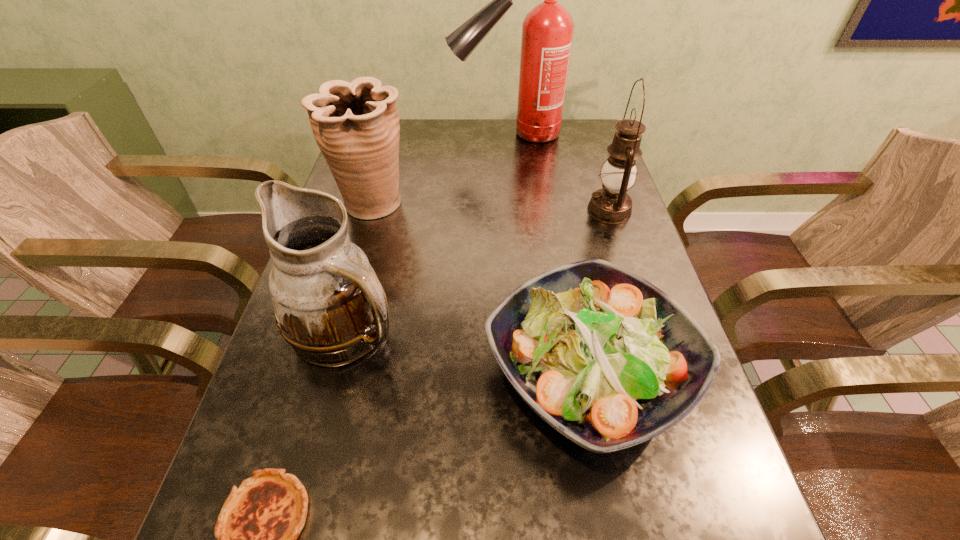
The height and width of the screenshot is (540, 960). What are the coordinates of `free region at the far edge` in the screenshot? It's located at (483, 141).

The height and width of the screenshot is (540, 960). Identify the location of vacant space at the right edge of the desktop. [635, 255].

I want to click on blank region between the urn and the oil lamp, so click(x=491, y=207).

The height and width of the screenshot is (540, 960). I want to click on free space between the pitcher and the fifth tallest object, so click(x=468, y=351).

Find the location of `unoccupied position between the second shortest object and the farthest object`. unoccupied position between the second shortest object and the farthest object is located at coordinates (549, 253).

In order to click on blank region between the oil lamp and the fire extinguisher in this screenshot , I will do `click(560, 172)`.

The image size is (960, 540). Identify the location of free area in between the pitcher and the tallest object. (429, 232).

You are a GUI agent. You are given a task and a screenshot of the screen. Output one action in this format:
    pyautogui.click(x=<x>, y=<y>)
    Task: Click on the free space between the second shortest object and the farthest object
    The width and height of the screenshot is (960, 540).
    Given the screenshot: What is the action you would take?
    pyautogui.click(x=549, y=253)

Locate an element on the screen. the closest object to the quiche is located at coordinates (329, 305).

Identify the location of the fifth closest object to the urn. 257,529.